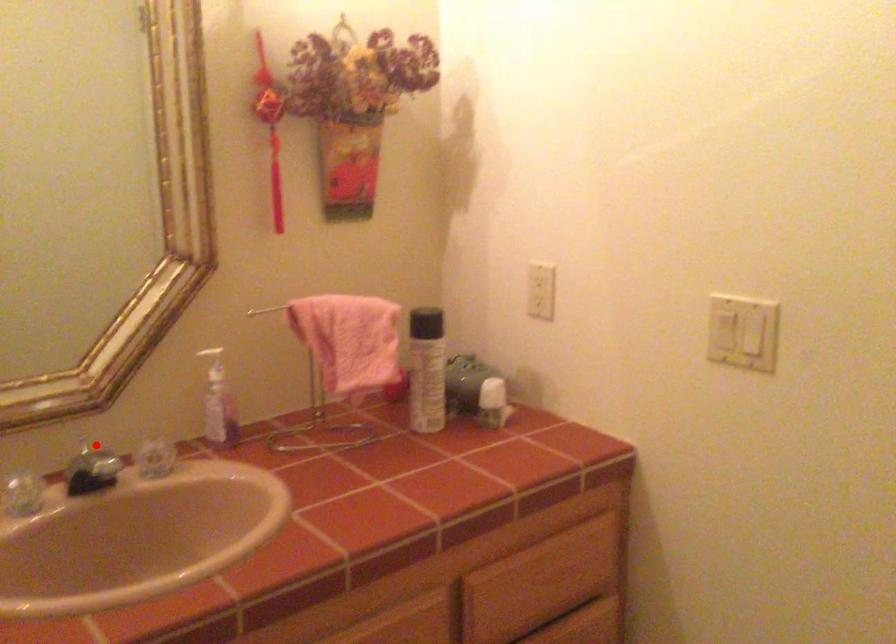
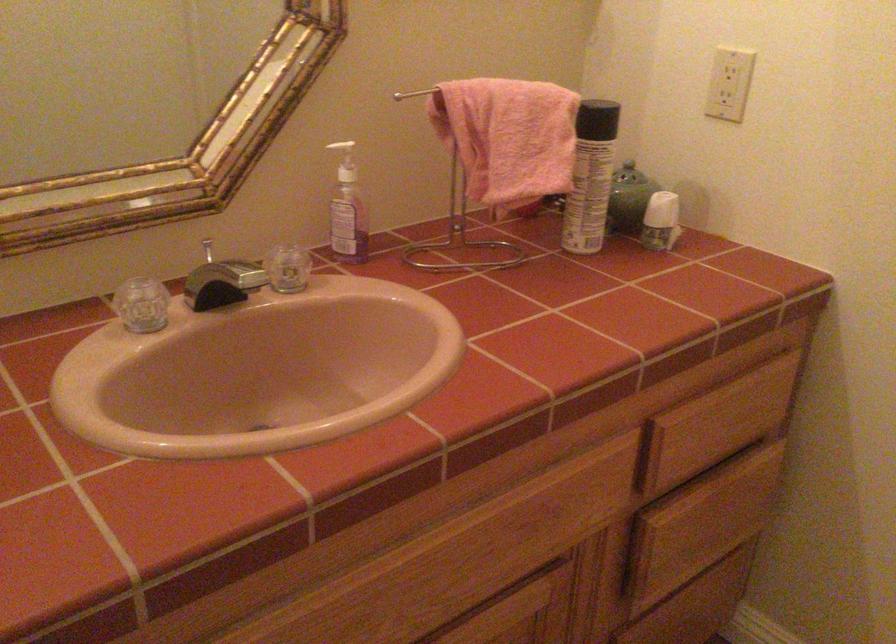
Question: A red point is marked in image1. In image2, is the corresponding 3D point closer to the camera or farther? Reply with the corresponding letter.

Choices:
 (A) The corresponding 3D point is closer.
 (B) The corresponding 3D point is farther.

Answer: (A)